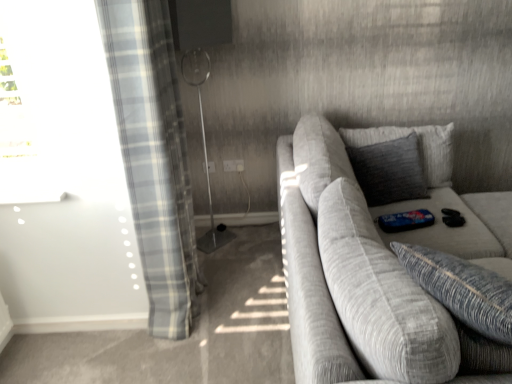
Question: Is light blue plaid curtain at left facing towards textured gray couch at right?

Choices:
 (A) yes
 (B) no

Answer: (A)

Question: Can you confirm if light blue plaid curtain at left is bigger than textured gray couch at right?

Choices:
 (A) no
 (B) yes

Answer: (A)

Question: Is textured gray couch at right located within light blue plaid curtain at left?

Choices:
 (A) yes
 (B) no

Answer: (B)

Question: Considering the relative sizes of light blue plaid curtain at left and textured gray couch at right in the image provided, is light blue plaid curtain at left smaller than textured gray couch at right?

Choices:
 (A) no
 (B) yes

Answer: (B)

Question: From a real-world perspective, is light blue plaid curtain at left under textured gray couch at right?

Choices:
 (A) no
 (B) yes

Answer: (A)

Question: Is light blue plaid curtain at left in front of or behind textured gray pillow at upper right in the image?

Choices:
 (A) front
 (B) behind

Answer: (A)

Question: In terms of height, does light blue plaid curtain at left look taller or shorter compared to textured gray pillow at upper right?

Choices:
 (A) short
 (B) tall

Answer: (B)

Question: From the image's perspective, is light blue plaid curtain at left above or below textured gray pillow at upper right?

Choices:
 (A) above
 (B) below

Answer: (B)

Question: Does point (163, 316) appear closer or farther from the camera than point (411, 163)?

Choices:
 (A) farther
 (B) closer

Answer: (B)

Question: From the image's perspective, relative to textured gray pillow at upper right, is textured gray couch at right above or below?

Choices:
 (A) above
 (B) below

Answer: (B)

Question: From a real-world perspective, is textured gray couch at right physically located above or below textured gray pillow at upper right?

Choices:
 (A) below
 (B) above

Answer: (A)

Question: Considering their positions, is textured gray couch at right located in front of or behind textured gray pillow at upper right?

Choices:
 (A) front
 (B) behind

Answer: (A)

Question: Looking at the image, does textured gray couch at right seem bigger or smaller compared to textured gray pillow at upper right?

Choices:
 (A) big
 (B) small

Answer: (A)

Question: Is light blue plaid curtain at left inside or outside of textured gray couch at right?

Choices:
 (A) outside
 (B) inside

Answer: (A)

Question: In terms of size, does light blue plaid curtain at left appear bigger or smaller than textured gray couch at right?

Choices:
 (A) big
 (B) small

Answer: (B)